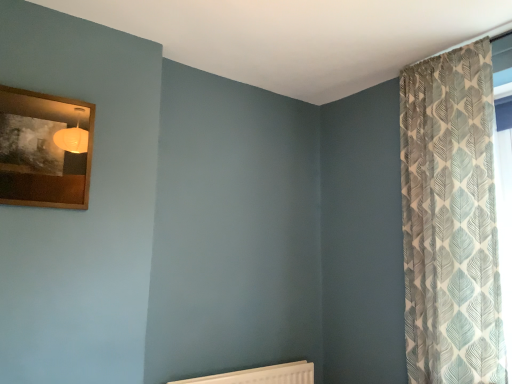
Question: Is patterned fabric curtain at right facing towards wooden picture frame at upper left?

Choices:
 (A) yes
 (B) no

Answer: (B)

Question: Is the depth of patterned fabric curtain at right less than that of wooden picture frame at upper left?

Choices:
 (A) yes
 (B) no

Answer: (B)

Question: Is patterned fabric curtain at right next to wooden picture frame at upper left?

Choices:
 (A) yes
 (B) no

Answer: (B)

Question: Is patterned fabric curtain at right smaller than wooden picture frame at upper left?

Choices:
 (A) yes
 (B) no

Answer: (B)

Question: Considering the relative sizes of patterned fabric curtain at right and wooden picture frame at upper left in the image provided, is patterned fabric curtain at right shorter than wooden picture frame at upper left?

Choices:
 (A) no
 (B) yes

Answer: (A)

Question: Does patterned fabric curtain at right have a larger size compared to wooden picture frame at upper left?

Choices:
 (A) yes
 (B) no

Answer: (A)

Question: Does wooden picture frame at upper left appear on the left side of white textured radiator at lower center?

Choices:
 (A) no
 (B) yes

Answer: (B)

Question: Is wooden picture frame at upper left further to camera compared to white textured radiator at lower center?

Choices:
 (A) yes
 (B) no

Answer: (B)

Question: Is wooden picture frame at upper left facing away from white textured radiator at lower center?

Choices:
 (A) yes
 (B) no

Answer: (B)

Question: Considering the relative sizes of wooden picture frame at upper left and white textured radiator at lower center in the image provided, is wooden picture frame at upper left taller than white textured radiator at lower center?

Choices:
 (A) no
 (B) yes

Answer: (B)

Question: From a real-world perspective, is wooden picture frame at upper left physically below white textured radiator at lower center?

Choices:
 (A) yes
 (B) no

Answer: (B)

Question: Does wooden picture frame at upper left turn towards white textured radiator at lower center?

Choices:
 (A) yes
 (B) no

Answer: (B)

Question: Can you confirm if wooden picture frame at upper left is smaller than patterned fabric curtain at right?

Choices:
 (A) yes
 (B) no

Answer: (A)